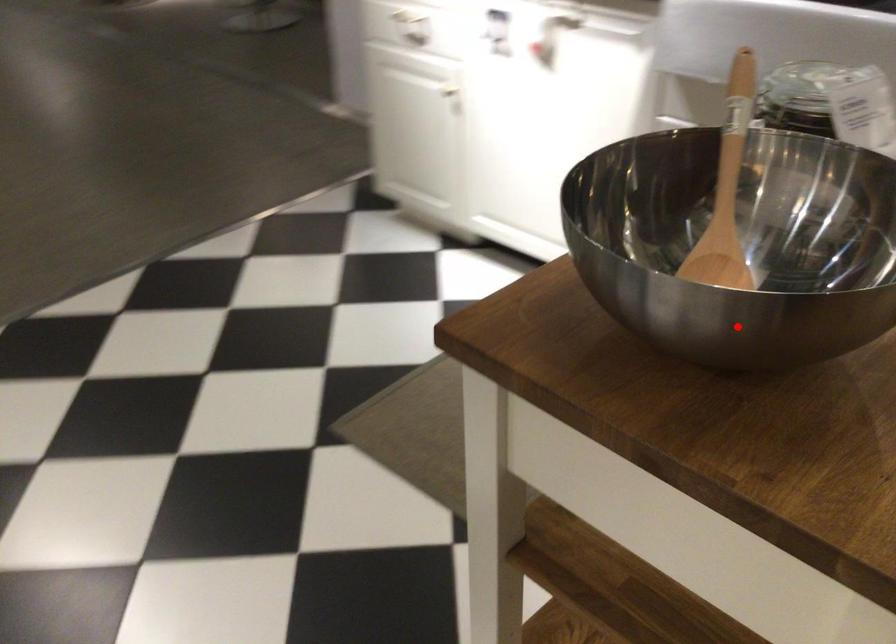
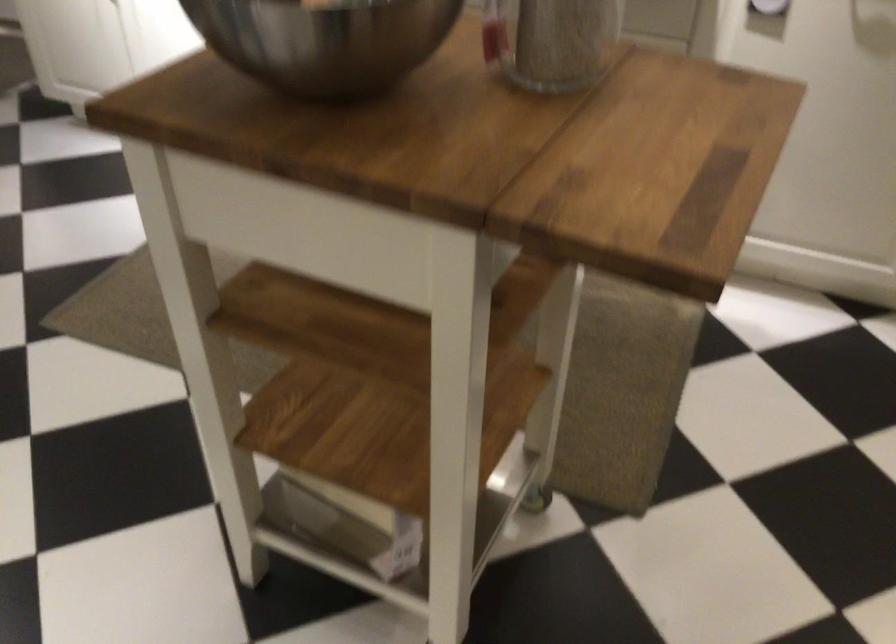
Question: I am providing you with two images of the same scene from different viewpoints. A red point is shown in image1. For the corresponding object point in image2, is it positioned nearer or farther from the camera?

Choices:
 (A) Nearer
 (B) Farther

Answer: (B)